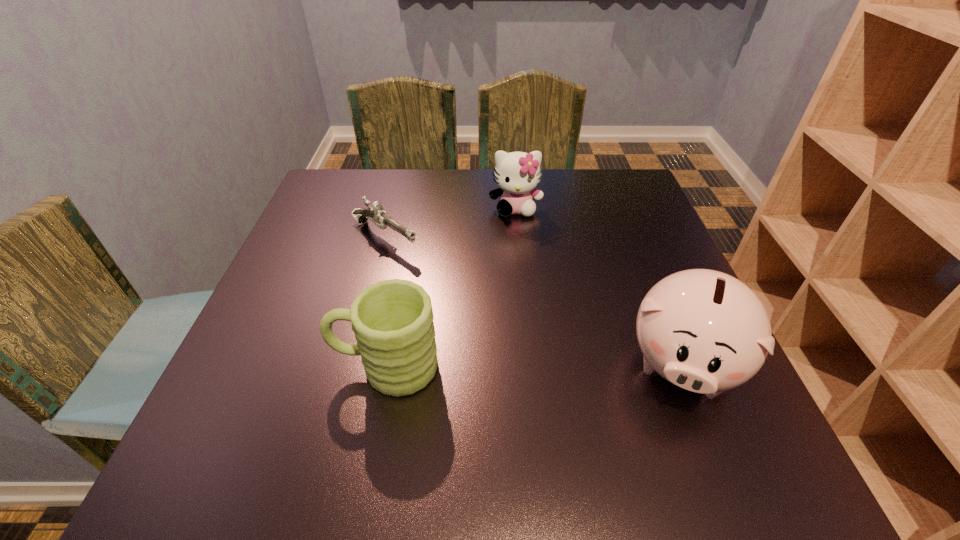
This screenshot has height=540, width=960. What are the coordinates of `mug` in the screenshot? It's located at (392, 320).

Where is `the rightmost object`? the rightmost object is located at coordinates (705, 331).

This screenshot has width=960, height=540. Identify the location of piggy bank. (705, 331).

Where is `the third object from left to right`? the third object from left to right is located at coordinates (517, 174).

Where is `the shortest object`? the shortest object is located at coordinates (375, 213).

You are a GUI agent. You are given a task and a screenshot of the screen. Output one action in this format:
    pyautogui.click(x=<x>, y=<y>)
    Task: Click on the vacant point located on the side of the mug with the handle
    
    Given the screenshot: What is the action you would take?
    pyautogui.click(x=290, y=367)

What are the coordinates of `vacant space located on the back of the tallest object` in the screenshot? It's located at (626, 227).

Identify the location of vacant region located 0.260m on the front-facing side of the kitten. This screenshot has width=960, height=540. (522, 291).

Identify the location of free location located on the front-facing side of the kitten. The image size is (960, 540). (520, 273).

Find the location of a particular element. This screenshot has height=540, width=960. vacant region located on the front-facing side of the kitten is located at coordinates (523, 312).